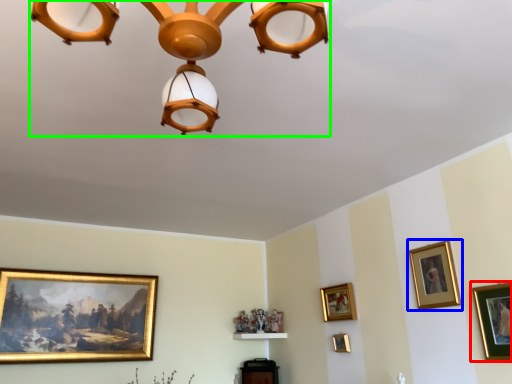
Question: Which object is the closest to the picture frame (highlighted by a red box)? Choose among these: picture frame (highlighted by a blue box) or lamp (highlighted by a green box).

Choices:
 (A) picture frame
 (B) lamp

Answer: (A)